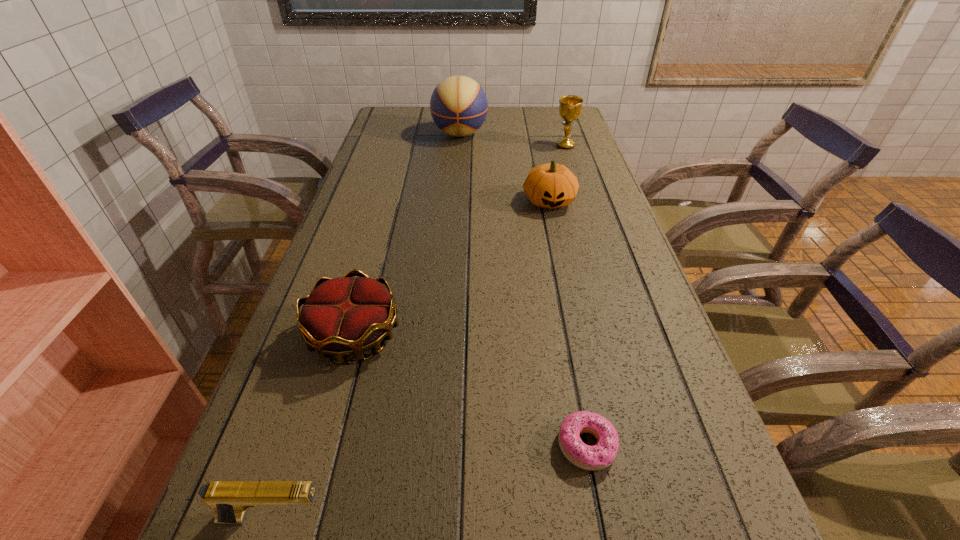
The image size is (960, 540). Find the location of `vacant space located 0.060m on the side of the third tallest object with the carved face`. vacant space located 0.060m on the side of the third tallest object with the carved face is located at coordinates (555, 230).

Find the location of a particular element. Image resolution: width=960 pixels, height=540 pixels. free spot located 0.230m on the back of the crown is located at coordinates (381, 239).

Locate an element on the screen. vacant space situated 0.100m at the barrel of the pistol is located at coordinates (397, 518).

This screenshot has width=960, height=540. Find the location of `vacant space situated 0.220m on the left of the doughnut`. vacant space situated 0.220m on the left of the doughnut is located at coordinates (422, 446).

Where is `object located at the far edge`? The image size is (960, 540). object located at the far edge is located at coordinates (458, 105).

Where is `crown at the left edge`? This screenshot has width=960, height=540. crown at the left edge is located at coordinates (345, 316).

This screenshot has width=960, height=540. I want to click on pistol located in the left edge section of the desktop, so click(x=230, y=499).

At what (x,y) coordinates should I click in order to perform the action: click on chalice that is at the right edge. Please return your answer as a coordinate pair (x, y). This screenshot has width=960, height=540. Looking at the image, I should click on (570, 106).

Image resolution: width=960 pixels, height=540 pixels. Find the location of `gourd situated at the right edge`. gourd situated at the right edge is located at coordinates (551, 185).

In the image, there is a desktop. Where is `free space at the far edge`? The height and width of the screenshot is (540, 960). free space at the far edge is located at coordinates (514, 109).